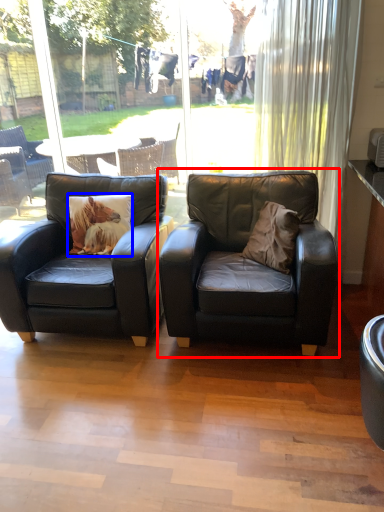
Question: Among these objects, which one is nearest to the camera, chair (highlighted by a red box) or pillow (highlighted by a blue box)?

Choices:
 (A) chair
 (B) pillow

Answer: (A)